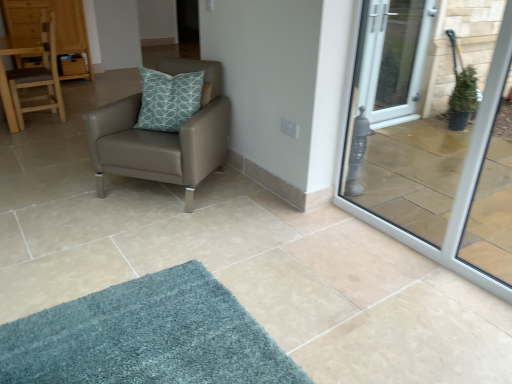
Question: Would you say matte brown leather chair at center, positioned as the first chair in front-to-back order, is part of wooden dresser at upper left's contents?

Choices:
 (A) yes
 (B) no

Answer: (B)

Question: Can you confirm if wooden dresser at upper left is wider than matte brown leather chair at center, positioned as the first chair in front-to-back order?

Choices:
 (A) no
 (B) yes

Answer: (A)

Question: Is wooden dresser at upper left positioned far away from matte brown leather chair at center, the 1th chair from the right?

Choices:
 (A) no
 (B) yes

Answer: (B)

Question: Is wooden dresser at upper left bigger than matte brown leather chair at center, the 1th chair from the right?

Choices:
 (A) yes
 (B) no

Answer: (A)

Question: Is wooden dresser at upper left placed right next to matte brown leather chair at center, which appears as the 2th chair when viewed from the back?

Choices:
 (A) no
 (B) yes

Answer: (A)

Question: Looking at the image, does transparent glass door at right seem bigger or smaller compared to wooden dresser at upper left?

Choices:
 (A) small
 (B) big

Answer: (A)

Question: From a real-world perspective, is transparent glass door at right above or below wooden dresser at upper left?

Choices:
 (A) below
 (B) above

Answer: (B)

Question: Based on their positions, is transparent glass door at right located to the left or right of wooden dresser at upper left?

Choices:
 (A) left
 (B) right

Answer: (B)

Question: In the image, is transparent glass door at right positioned in front of or behind wooden dresser at upper left?

Choices:
 (A) behind
 (B) front

Answer: (B)

Question: In terms of width, does transparent glass door at right look wider or thinner when compared to matte brown leather chair at center, which appears as the 2th chair when viewed from the back?

Choices:
 (A) thin
 (B) wide

Answer: (A)

Question: From the image's perspective, is transparent glass door at right positioned above or below matte brown leather chair at center, the 1th chair from the right?

Choices:
 (A) above
 (B) below

Answer: (B)

Question: Based on their positions, is transparent glass door at right located to the left or right of matte brown leather chair at center, which appears as the second chair when viewed from the left?

Choices:
 (A) left
 (B) right

Answer: (B)

Question: Considering their positions, is transparent glass door at right located in front of or behind matte brown leather chair at center, positioned as the first chair in front-to-back order?

Choices:
 (A) behind
 (B) front

Answer: (B)

Question: Considering their positions, is transparent glass door at right located in front of or behind light brown wooden chair at left, positioned as the second chair in front-to-back order?

Choices:
 (A) front
 (B) behind

Answer: (A)

Question: From the image's perspective, is transparent glass door at right positioned above or below light brown wooden chair at left, positioned as the second chair in front-to-back order?

Choices:
 (A) below
 (B) above

Answer: (A)